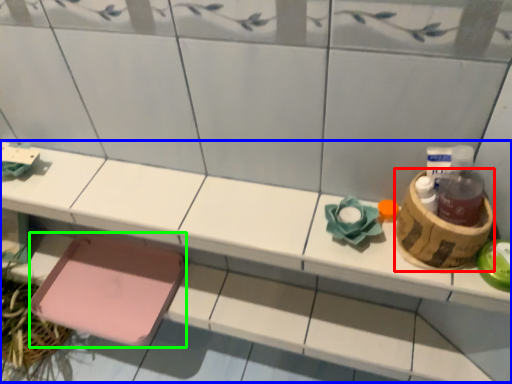
Question: Based on their relative distances, which object is farther from basket (highlighted by a red box)? Choose from vanity (highlighted by a blue box) and step stool (highlighted by a green box).

Choices:
 (A) vanity
 (B) step stool

Answer: (B)